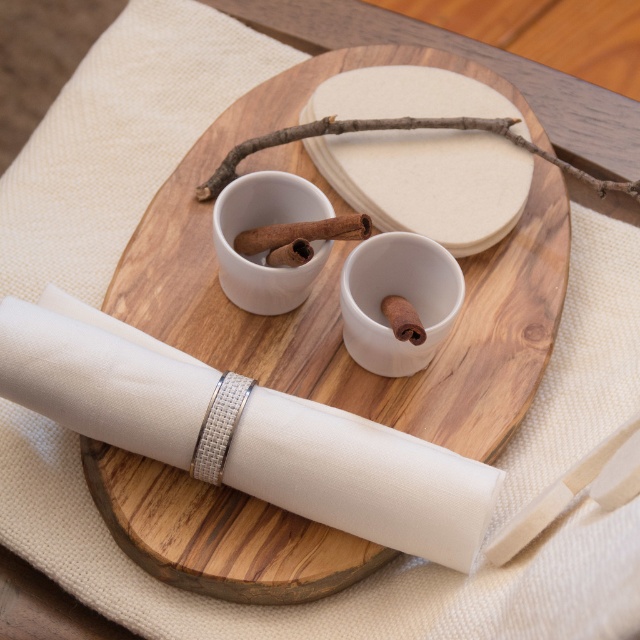
In the scene shown: Is brown rough twig at upper center positioned before brown wood cinnamon stick at center?

No.

Is brown rough twig at upper center further to camera compared to brown wood cinnamon stick at center?

Yes, brown rough twig at upper center is further from the viewer.

Describe the element at coordinates (392, 129) in the screenshot. The image size is (640, 640). I see `brown rough twig at upper center` at that location.

Where is `brown rough twig at upper center`? The width and height of the screenshot is (640, 640). brown rough twig at upper center is located at coordinates (392, 129).

Can you confirm if wooden tray at center is shorter than brown wood cinnamon stick at center?

No.

Describe the element at coordinates (337, 285) in the screenshot. I see `wooden tray at center` at that location.

Does point (180, 337) come farther from viewer compared to point (342, 221)?

Yes.

The image size is (640, 640). Identify the location of wooden tray at center. (337, 285).

Does white fabric napkin at center appear over brown wood cinnamon stick at center?

No.

Does white fabric napkin at center appear on the right side of brown wood cinnamon stick at center?

In fact, white fabric napkin at center is to the left of brown wood cinnamon stick at center.

Which is in front, point (426, 461) or point (275, 225)?

Point (426, 461) is in front.

Locate an element on the screen. This screenshot has height=640, width=640. white fabric napkin at center is located at coordinates (362, 477).